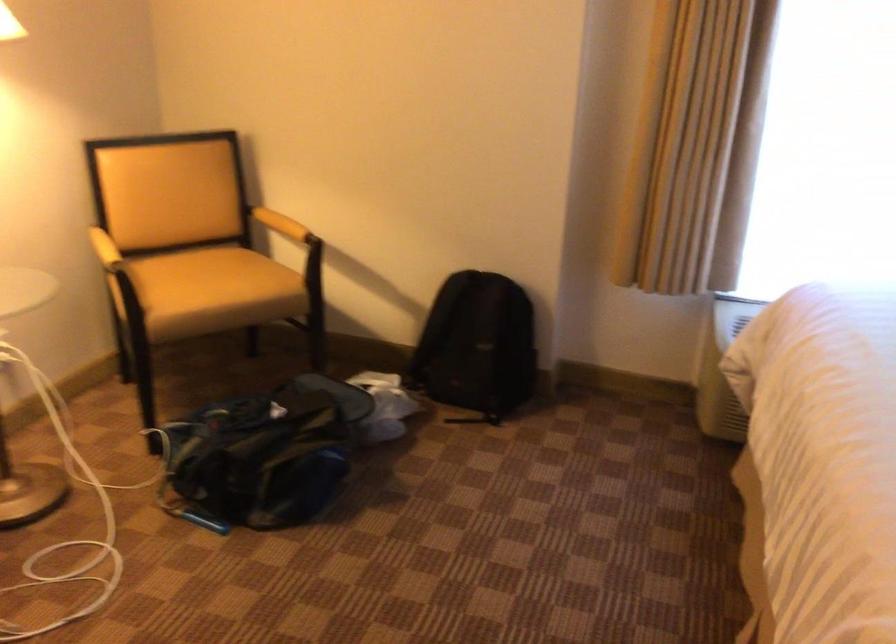
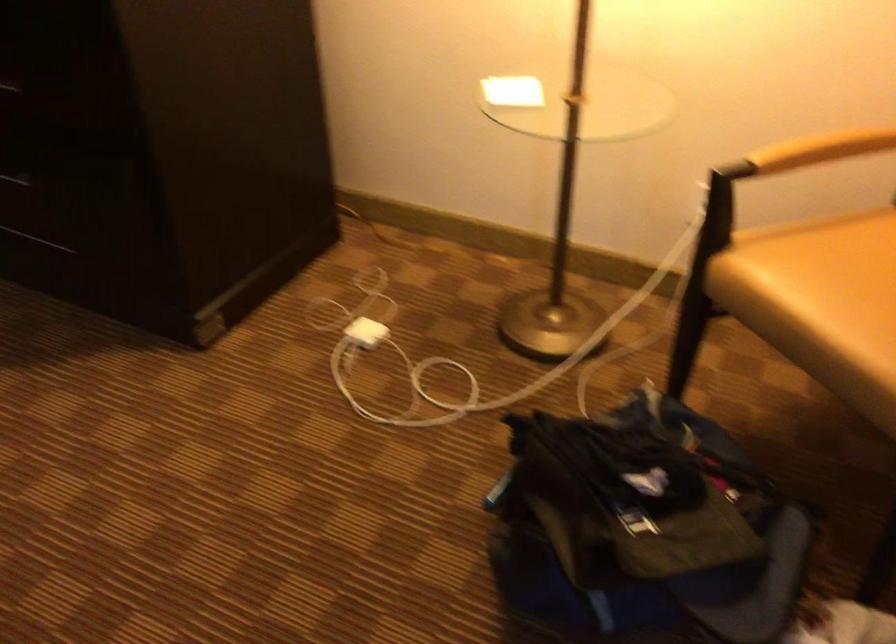
Where in the second image is the point corresponding to pixel 126 237 from the first image?

(821, 149)